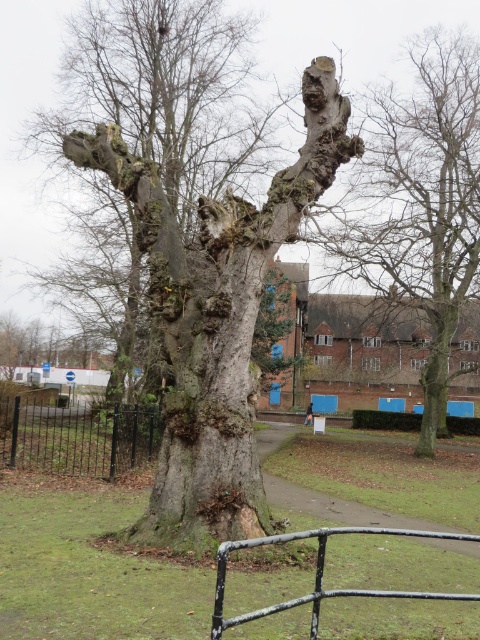
You are a painter standing at the lower center of the image, looking towards the smooth bark tree at upper right. You want to paint the tree but need to know if it will fit in your canvas which is as tall as the black metal rail at lower center. Can the tree be fully captured in your canvas?

The smooth bark tree at upper right is much taller than the black metal rail at lower center. Since the canvas is as tall as the rail, the tree cannot be fully captured in the canvas.

You are a park maintenance worker checking the trees in the park. You notice two trees with smooth bark. One is the smooth gray bark at center and the other is the smooth bark tree at upper right. Which tree has a thicker trunk?

The smooth bark tree at upper right has a thicker trunk than the smooth gray bark at center.

You are a park visitor who wants to take a photo of both the smooth gray bark at center and the smooth bark tree at upper right. Which one should you stand closer to in order to capture both in a single frame?

You should stand closer to the smooth gray bark at center because it is shorter than the smooth bark tree at upper right, allowing both to fit within the camera frame more easily.